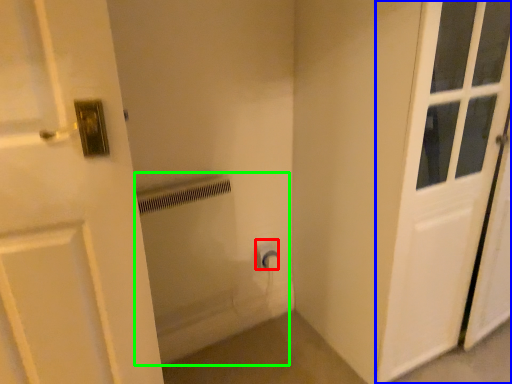
Question: Considering the real-world distances, which object is farthest from electric outlet (highlighted by a red box)? door (highlighted by a blue box) or bath (highlighted by a green box)?

Choices:
 (A) door
 (B) bath

Answer: (A)